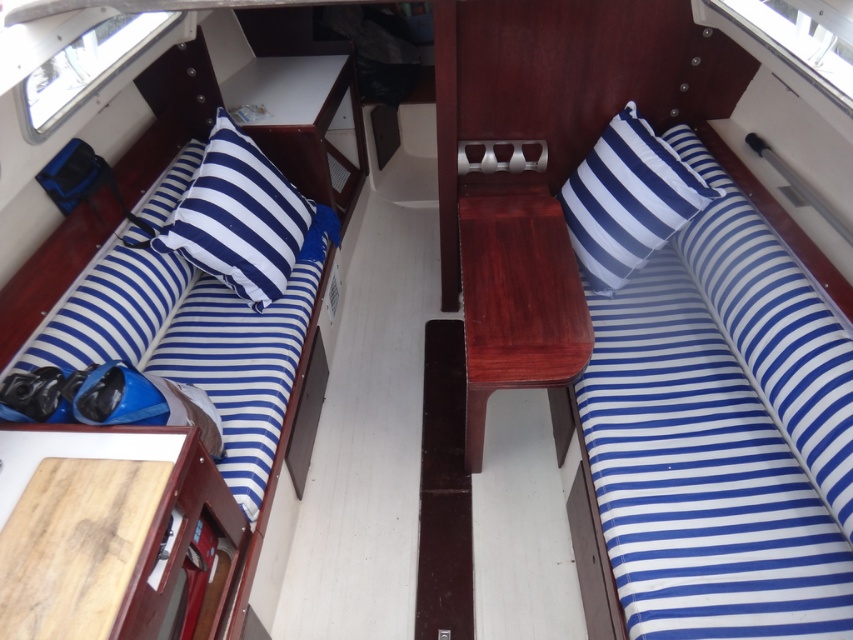
Does blue striped pillow at left appear on the left side of blue striped cushion at upper right?

Correct, you'll find blue striped pillow at left to the left of blue striped cushion at upper right.

Who is shorter, blue striped pillow at left or blue striped cushion at upper right?

blue striped cushion at upper right is shorter.

Image resolution: width=853 pixels, height=640 pixels. Identify the location of blue striped pillow at left. (238, 218).

Where is `blue striped pillow at left`? blue striped pillow at left is located at coordinates (238, 218).